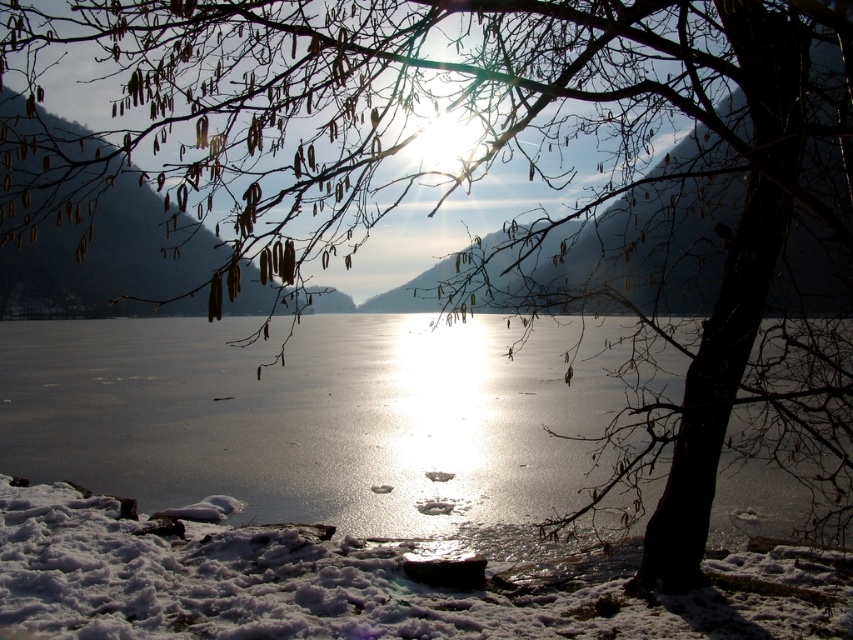
Question: Is transparent ice at center thinner than white fluffy snow at lower left?

Choices:
 (A) no
 (B) yes

Answer: (A)

Question: Which object appears closest to the camera in this image?

Choices:
 (A) transparent ice at center
 (B) white fluffy snow at lower left

Answer: (B)

Question: Which of the following is the farthest from the observer?

Choices:
 (A) white fluffy snow at lower left
 (B) transparent ice at center

Answer: (B)

Question: Is transparent ice at center positioned behind white fluffy snow at lower left?

Choices:
 (A) no
 (B) yes

Answer: (B)

Question: From the image, what is the correct spatial relationship of transparent ice at center in relation to white fluffy snow at lower left?

Choices:
 (A) right
 (B) left

Answer: (B)